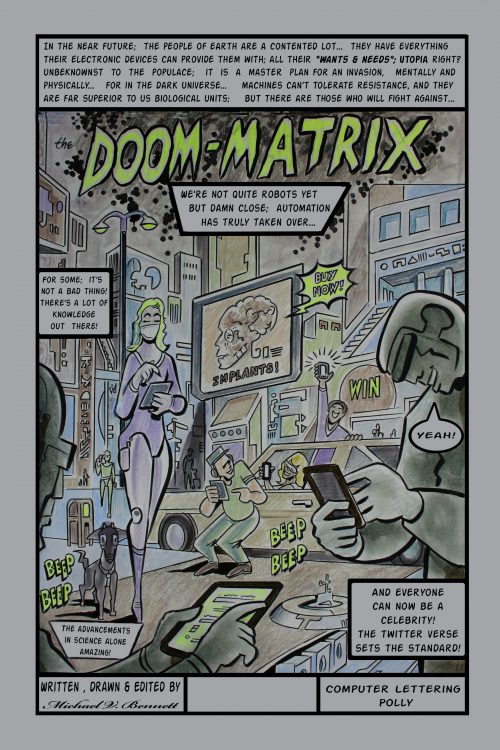
The image size is (500, 750). In order to click on stairs in this screenshot , I will do `click(365, 328)`.